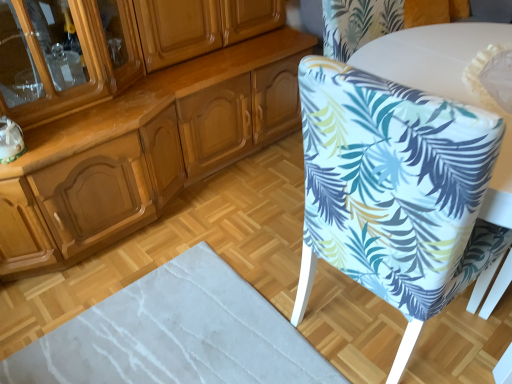
Question: Considering the relative sizes of white glossy round table at upper right and transparent glass cabinet at upper left in the image provided, is white glossy round table at upper right taller than transparent glass cabinet at upper left?

Choices:
 (A) yes
 (B) no

Answer: (A)

Question: From the image's perspective, is white glossy round table at upper right under transparent glass cabinet at upper left?

Choices:
 (A) no
 (B) yes

Answer: (B)

Question: From a real-world perspective, is white glossy round table at upper right positioned over transparent glass cabinet at upper left based on gravity?

Choices:
 (A) yes
 (B) no

Answer: (B)

Question: Is white glossy round table at upper right shorter than transparent glass cabinet at upper left?

Choices:
 (A) no
 (B) yes

Answer: (A)

Question: Considering the relative positions of white glossy round table at upper right and transparent glass cabinet at upper left in the image provided, is white glossy round table at upper right to the left of transparent glass cabinet at upper left from the viewer's perspective?

Choices:
 (A) no
 (B) yes

Answer: (A)

Question: Does white glossy round table at upper right have a lesser width compared to transparent glass cabinet at upper left?

Choices:
 (A) yes
 (B) no

Answer: (B)

Question: Does white glossy round table at upper right have a greater height compared to white fabric-covered chair at right?

Choices:
 (A) yes
 (B) no

Answer: (A)

Question: Is white glossy round table at upper right facing away from white fabric-covered chair at right?

Choices:
 (A) no
 (B) yes

Answer: (A)

Question: Are white glossy round table at upper right and white fabric-covered chair at right making contact?

Choices:
 (A) yes
 (B) no

Answer: (B)

Question: Considering the relative sizes of white glossy round table at upper right and white fabric-covered chair at right in the image provided, is white glossy round table at upper right thinner than white fabric-covered chair at right?

Choices:
 (A) no
 (B) yes

Answer: (A)

Question: From a real-world perspective, is white glossy round table at upper right under white fabric-covered chair at right?

Choices:
 (A) yes
 (B) no

Answer: (A)

Question: From a real-world perspective, is white glossy round table at upper right located higher than white fabric-covered chair at right?

Choices:
 (A) yes
 (B) no

Answer: (B)

Question: Is white fabric-covered chair at right inside transparent glass cabinet at upper left?

Choices:
 (A) yes
 (B) no

Answer: (B)